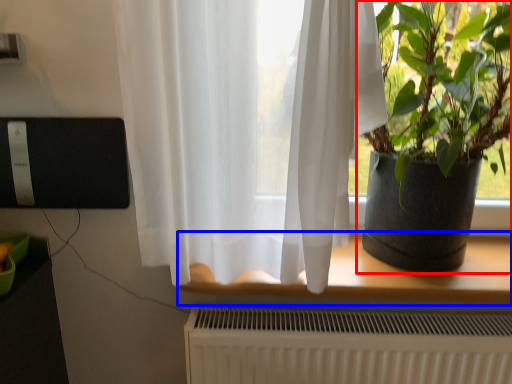
Question: Among these objects, which one is nearest to the camera, houseplant (highlighted by a red box) or window (highlighted by a blue box)?

Choices:
 (A) houseplant
 (B) window

Answer: (A)